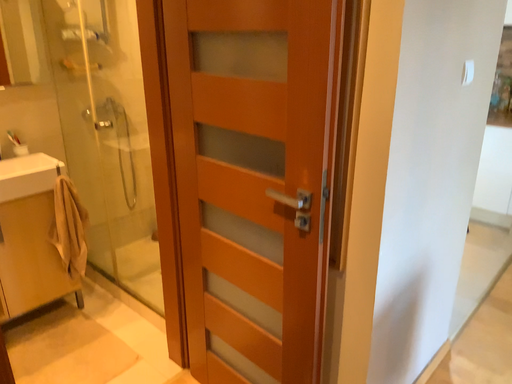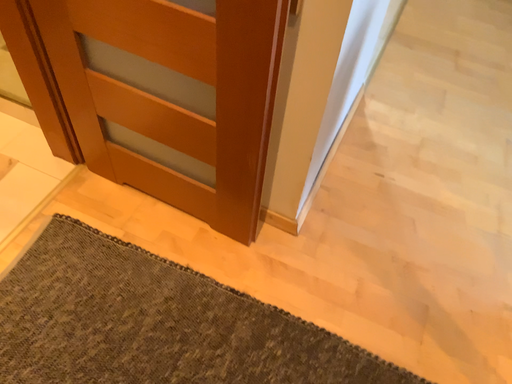
Question: How did the camera likely rotate when shooting the video?

Choices:
 (A) rotated right
 (B) rotated left

Answer: (A)